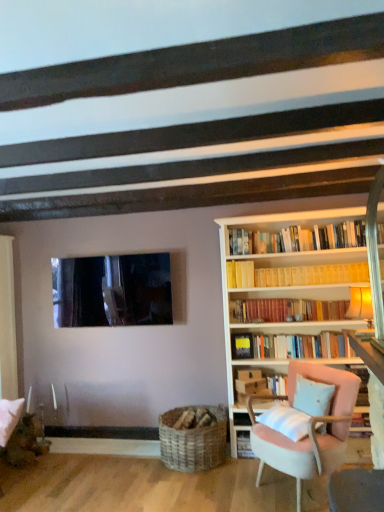
Find the location of `free spot below transparent glass window at upper center (from a real-world perspective)`. free spot below transparent glass window at upper center (from a real-world perspective) is located at coordinates (106, 439).